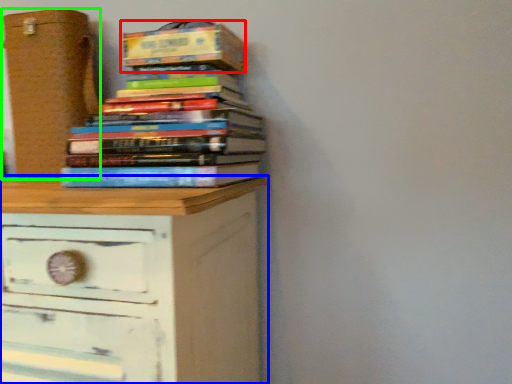
Question: Which object is the farthest from paperback book (highlighted by a red box)? Choose among these: chest of drawers (highlighted by a blue box) or cardboard box (highlighted by a green box).

Choices:
 (A) chest of drawers
 (B) cardboard box

Answer: (A)